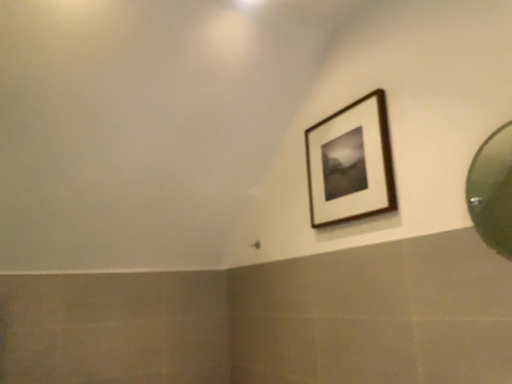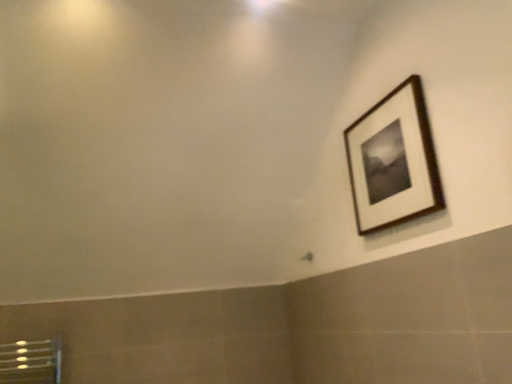
Question: How did the camera likely rotate when shooting the video?

Choices:
 (A) rotated right
 (B) rotated left

Answer: (B)